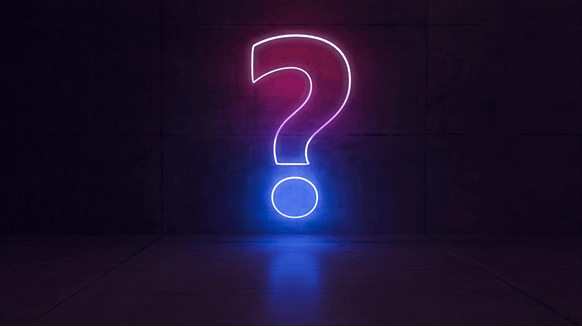
You are a GUI agent. You are given a task and a screenshot of the screen. Output one action in this format:
    pyautogui.click(x=<x>, y=<y>)
    Task: Click on the blue light reflection on glossy floor
    
    Given the screenshot: What is the action you would take?
    pos(291,268)